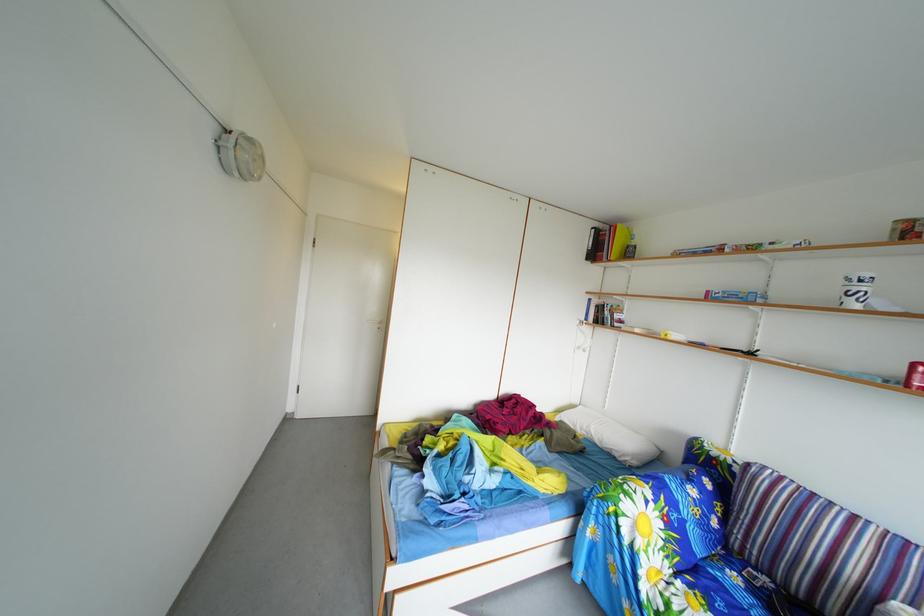
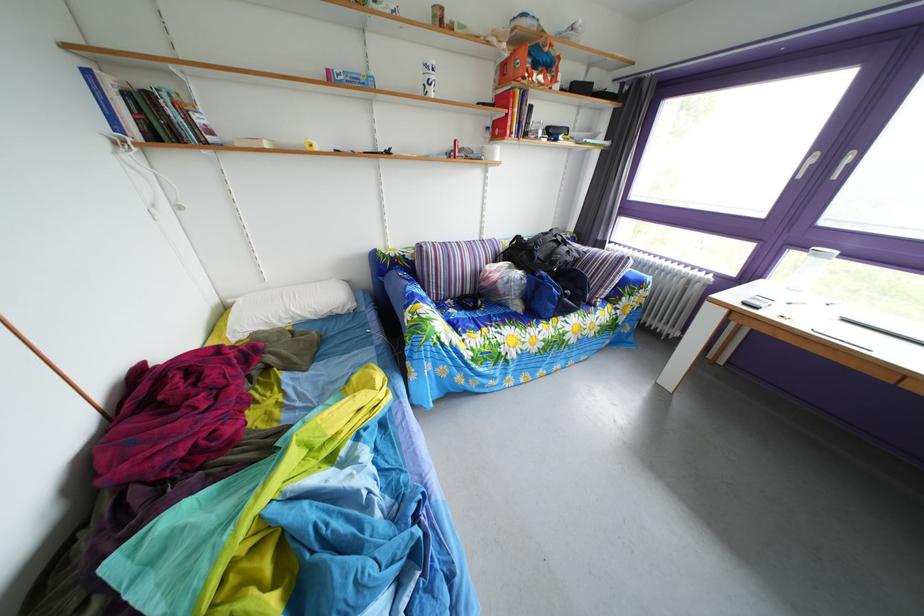
Locate, in the second image, the point that corresponds to pixel 695 485 in the first image.

(417, 290)